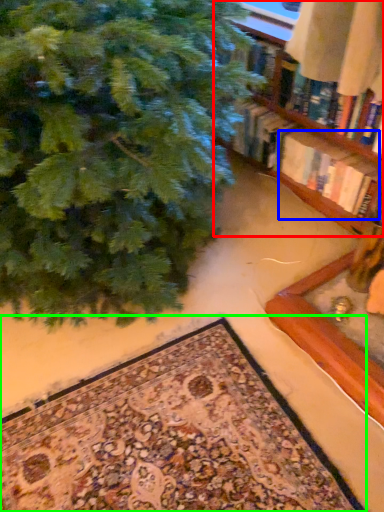
Question: Estimate the real-world distances between objects in this image. Which object is closer to shelf (highlighted by a red box), book (highlighted by a blue box) or mat (highlighted by a green box)?

Choices:
 (A) book
 (B) mat

Answer: (A)